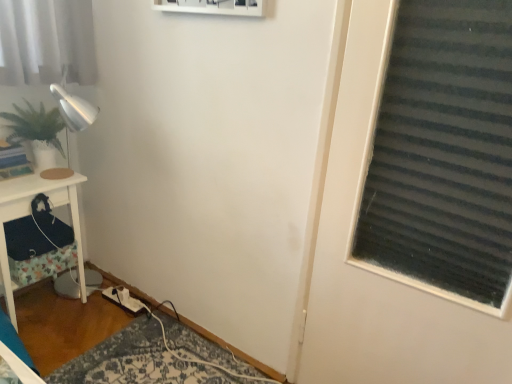
Question: Considering the relative positions of white wood side table at left and green matte plant at left in the image provided, is white wood side table at left to the left of green matte plant at left from the viewer's perspective?

Choices:
 (A) yes
 (B) no

Answer: (A)

Question: Does white wood side table at left have a lesser width compared to green matte plant at left?

Choices:
 (A) yes
 (B) no

Answer: (B)

Question: Does white wood side table at left have a greater width compared to green matte plant at left?

Choices:
 (A) no
 (B) yes

Answer: (B)

Question: From the image's perspective, is white wood side table at left located above green matte plant at left?

Choices:
 (A) yes
 (B) no

Answer: (B)

Question: Is white wood side table at left smaller than green matte plant at left?

Choices:
 (A) yes
 (B) no

Answer: (B)

Question: Which is correct: white fabric extension cord at lower left is inside white wood side table at left, or outside of it?

Choices:
 (A) outside
 (B) inside

Answer: (A)

Question: From the image's perspective, is white fabric extension cord at lower left positioned above or below white wood side table at left?

Choices:
 (A) above
 (B) below

Answer: (B)

Question: Relative to white wood side table at left, is white fabric extension cord at lower left in front or behind?

Choices:
 (A) front
 (B) behind

Answer: (B)

Question: Considering the positions of point (117, 286) and point (24, 187), is point (117, 286) closer or farther from the camera than point (24, 187)?

Choices:
 (A) closer
 (B) farther

Answer: (B)

Question: Considering the positions of point (52, 160) and point (19, 210), is point (52, 160) closer or farther from the camera than point (19, 210)?

Choices:
 (A) closer
 (B) farther

Answer: (B)

Question: Considering the relative positions of green matte plant at left and white wood side table at left in the image provided, is green matte plant at left to the left or to the right of white wood side table at left?

Choices:
 (A) left
 (B) right

Answer: (B)

Question: From the image's perspective, is green matte plant at left positioned above or below white wood side table at left?

Choices:
 (A) below
 (B) above

Answer: (B)

Question: Relative to white wood side table at left, is green matte plant at left in front or behind?

Choices:
 (A) behind
 (B) front

Answer: (A)

Question: Does point (37, 148) appear closer or farther from the camera than point (136, 301)?

Choices:
 (A) farther
 (B) closer

Answer: (B)

Question: From the image's perspective, is green matte plant at left located above or below white fabric extension cord at lower left?

Choices:
 (A) above
 (B) below

Answer: (A)